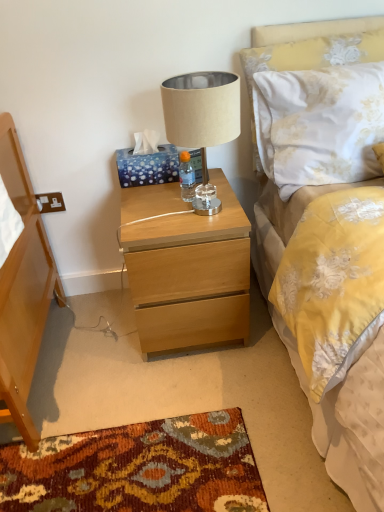
Identify the location of free space in front of light wood nightstand at center. (187, 402).